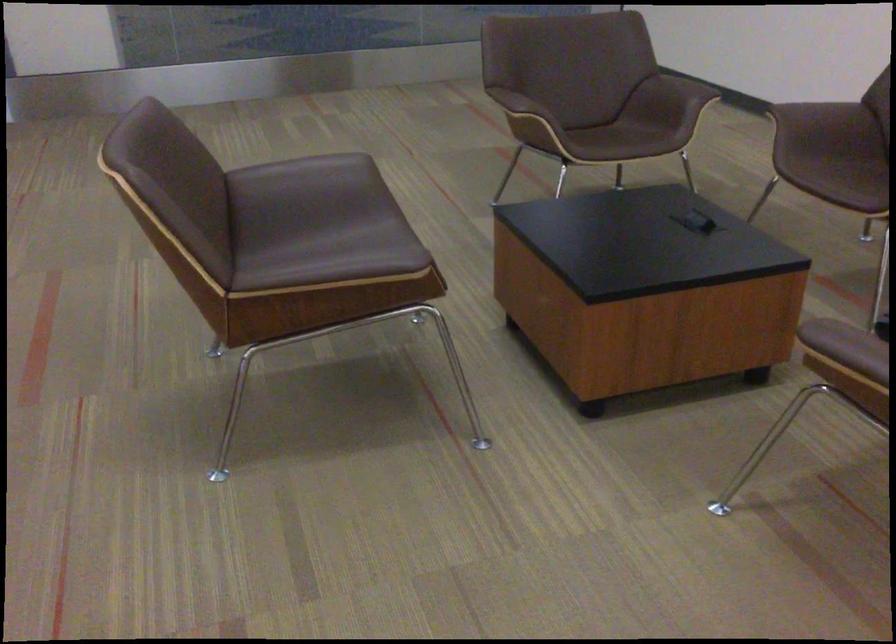
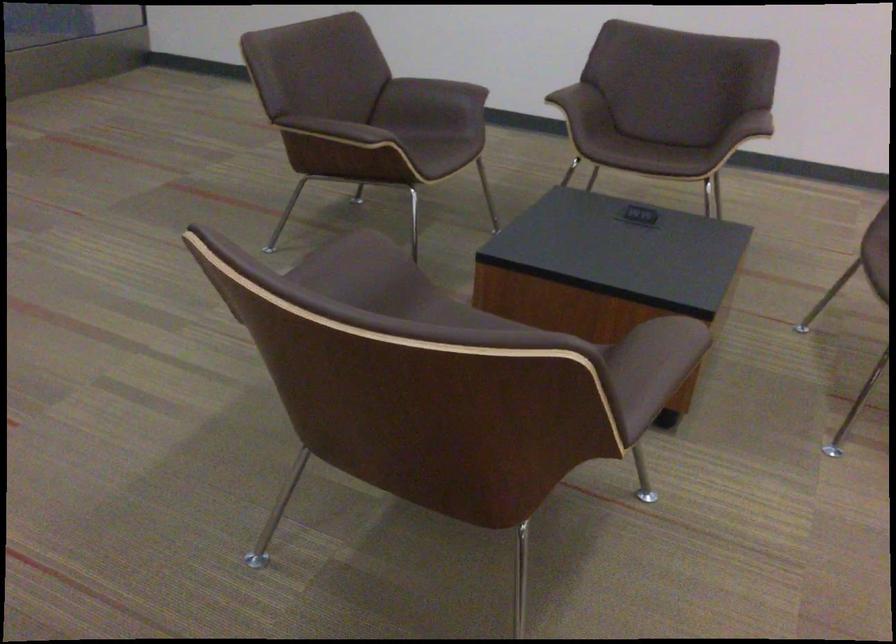
Where in the second image is the point corresponding to (494,91) from the first image?

(334, 129)